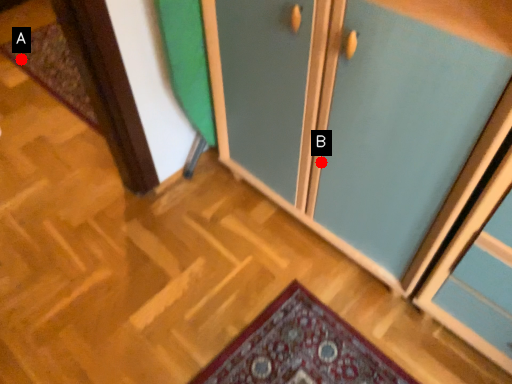
Question: Two points are circled on the image, labeled by A and B beside each circle. Which of the following is the closest to the observer?

Choices:
 (A) A is closer
 (B) B is closer

Answer: (B)